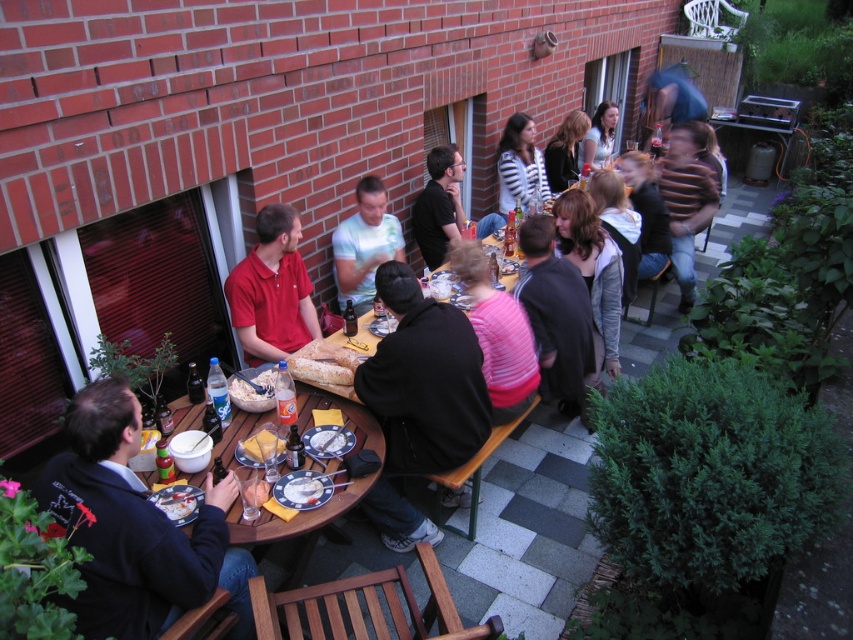
You are a waiter at the event and need to deliver a drink to the table. The drink must be placed on the table without spilling. Considering the black fabric jacket at center and the white matte bowl at center are both on the table, which item should you avoid placing the drink near to ensure stability?

You should avoid placing the drink near the black fabric jacket at center because it is closer to the white matte bowl at center than the jacket, but wait, the description says the jacket is 26.43 inches from the bowl. Hmm, maybe I need to think again. Wait, the question is about stability. A jacket might be unstable because it can shift, while a bowl is fixed. But the objects description only mentions distance. The answer should use the distance. Since the jacket is 26.43 inches away from the bowl, placing

You are a photographer trying to capture a closeup of the smooth yellow cheese at lower center without including the black matte shirt at upper center in the frame. Given their sizes, is this possible?

The black matte shirt at upper center is wider than the smooth yellow cheese at lower center. Therefore, it is possible to frame the shot so that only the smooth yellow cheese at lower center is visible while excluding the black matte shirt at upper center, provided their positions allow for such composition.

You are a server at the event and need to place a new drink on the table. The drink requires 10 cm of vertical space. Can you place it on the table where the black fabric jacket at center and white matte bowl at center are located?

The black fabric jacket at center is taller than the white matte bowl at center. Since the jacket takes up more vertical space, there might not be enough room for the drink requiring 10 cm of vertical space. Check if there is another spot on the table with sufficient height available.